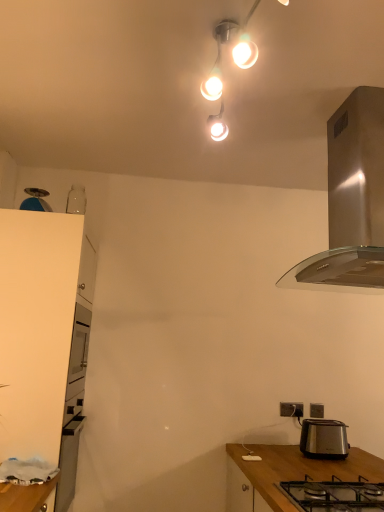
The height and width of the screenshot is (512, 384). In order to click on free space above matte white light fixture at upper center (from a real-world perspective) in this screenshot , I will do `click(236, 53)`.